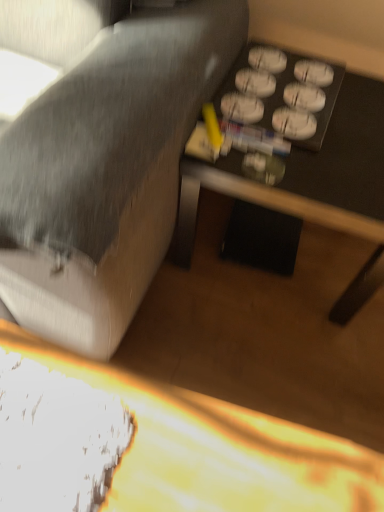
Identify the location of empty space that is ontop of black plastic table at lower right, the 2th table when ordered from bottom to top. (315, 121).